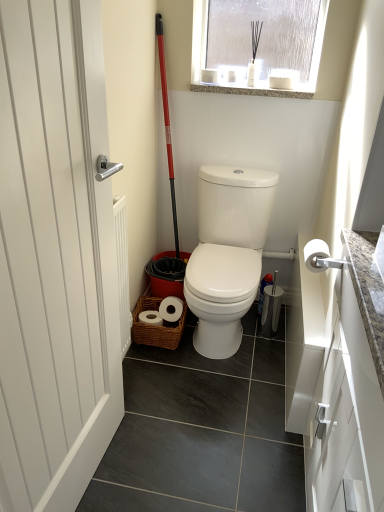
Question: Can you confirm if white glossy toilet at center is smaller than frosted glass window at upper center?

Choices:
 (A) no
 (B) yes

Answer: (A)

Question: Is frosted glass window at upper center a part of white glossy toilet at center?

Choices:
 (A) yes
 (B) no

Answer: (B)

Question: Is white glossy toilet at center in front of frosted glass window at upper center?

Choices:
 (A) no
 (B) yes

Answer: (B)

Question: Is white glossy toilet at center wider than frosted glass window at upper center?

Choices:
 (A) yes
 (B) no

Answer: (A)

Question: Is white glossy toilet at center bigger than frosted glass window at upper center?

Choices:
 (A) yes
 (B) no

Answer: (A)

Question: Can you confirm if white glossy toilet at center is shorter than frosted glass window at upper center?

Choices:
 (A) no
 (B) yes

Answer: (A)

Question: Can you confirm if white matte toilet paper at right is thinner than white glossy toilet at center?

Choices:
 (A) yes
 (B) no

Answer: (A)

Question: Does white matte toilet paper at right have a larger size compared to white glossy toilet at center?

Choices:
 (A) yes
 (B) no

Answer: (B)

Question: Does white matte toilet paper at right have a greater width compared to white glossy toilet at center?

Choices:
 (A) yes
 (B) no

Answer: (B)

Question: Is white matte toilet paper at right smaller than white glossy toilet at center?

Choices:
 (A) yes
 (B) no

Answer: (A)

Question: Does white matte toilet paper at right lie behind white glossy toilet at center?

Choices:
 (A) no
 (B) yes

Answer: (A)

Question: Is white matte toilet paper at right taller than white glossy toilet at center?

Choices:
 (A) yes
 (B) no

Answer: (B)

Question: Is granite at upper center far from white matte toilet paper at right?

Choices:
 (A) yes
 (B) no

Answer: (B)